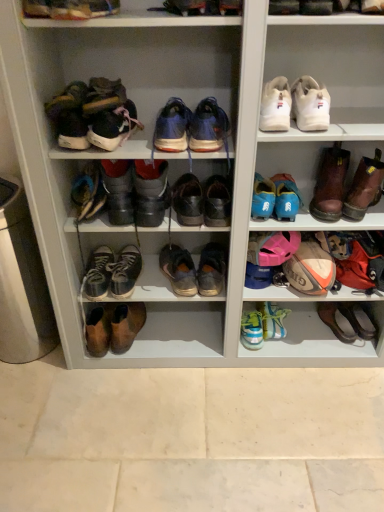
Question: Is leather at center, the sixth shoe when ordered from left to right, next to leather shoes at center, acting as the 5th footwear starting from the left?

Choices:
 (A) yes
 (B) no

Answer: (B)

Question: Is leather at center, the sixth shoe when ordered from left to right, bigger than leather shoes at center, which appears as the 7th footwear when viewed from the right?

Choices:
 (A) yes
 (B) no

Answer: (B)

Question: Is leather at center, which appears as the 4th shoe when viewed from the right, not within leather shoes at center, acting as the 5th footwear starting from the left?

Choices:
 (A) yes
 (B) no

Answer: (A)

Question: Considering the relative positions of leather at center, which appears as the 4th shoe when viewed from the right, and leather shoes at center, acting as the 5th footwear starting from the left, in the image provided, is leather at center, which appears as the 4th shoe when viewed from the right, in front of leather shoes at center, acting as the 5th footwear starting from the left,?

Choices:
 (A) no
 (B) yes

Answer: (A)

Question: Is leather at center, the sixth shoe when ordered from left to right, shorter than leather shoes at center, which appears as the 7th footwear when viewed from the right?

Choices:
 (A) no
 (B) yes

Answer: (B)

Question: Is worn leather shoes at center, placed as the 7th footwear when sorted from left to right, bigger or smaller than light blue synthetic sneakers at lower center, which ranks as the seventh shoe in left-to-right order?

Choices:
 (A) small
 (B) big

Answer: (B)

Question: Is point (200, 285) closer or farther from the camera than point (259, 334)?

Choices:
 (A) closer
 (B) farther

Answer: (A)

Question: Is worn leather shoes at center, placed as the 5th footwear when sorted from right to left, in front of or behind light blue synthetic sneakers at lower center, which ranks as the seventh shoe in left-to-right order, in the image?

Choices:
 (A) behind
 (B) front

Answer: (B)

Question: Do you think worn leather shoes at center, placed as the 7th footwear when sorted from left to right, is within light blue synthetic sneakers at lower center, which ranks as the seventh shoe in left-to-right order, or outside of it?

Choices:
 (A) inside
 (B) outside

Answer: (B)

Question: Is worn leather shoes at center, the 5th shoe from the left, wider or thinner than leather shoes at center, acting as the 5th footwear starting from the left?

Choices:
 (A) wide
 (B) thin

Answer: (A)

Question: From a real-world perspective, is worn leather shoes at center, the 5th shoe from the left, positioned above or below leather shoes at center, which appears as the 7th footwear when viewed from the right?

Choices:
 (A) below
 (B) above

Answer: (A)

Question: From the image's perspective, relative to leather shoes at center, acting as the 5th footwear starting from the left, is worn leather shoes at center, the 5th shoe from the left, above or below?

Choices:
 (A) above
 (B) below

Answer: (B)

Question: Does point (213, 266) appear closer or farther from the camera than point (139, 224)?

Choices:
 (A) closer
 (B) farther

Answer: (B)

Question: Considering the positions of point (175, 128) and point (162, 196), is point (175, 128) closer or farther from the camera than point (162, 196)?

Choices:
 (A) farther
 (B) closer

Answer: (B)

Question: In the image, is shiny blue sneakers at center, arranged as the 6th footwear when viewed from the right, on the left side or the right side of leather shoes at center, which appears as the 7th footwear when viewed from the right?

Choices:
 (A) left
 (B) right

Answer: (B)